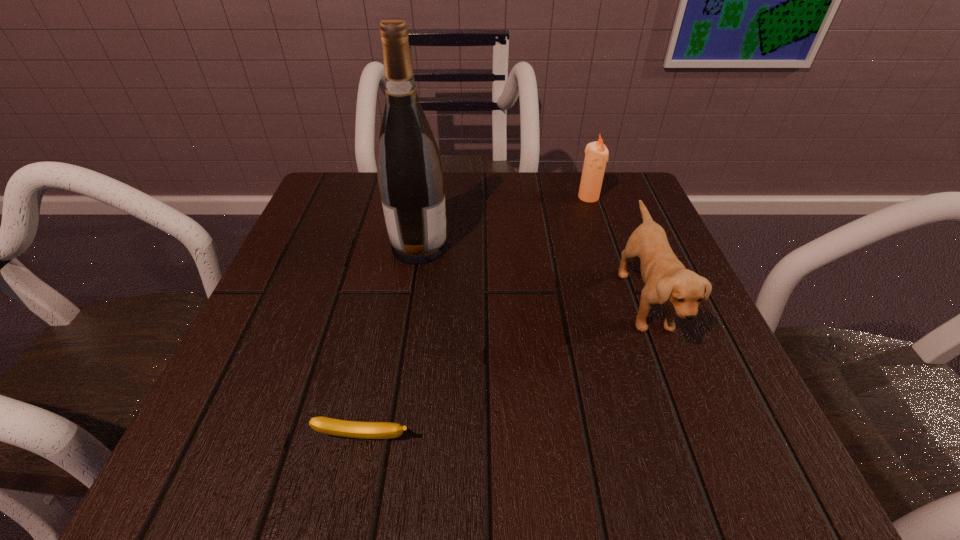
Image resolution: width=960 pixels, height=540 pixels. What are the coordinates of `wine bottle` in the screenshot? It's located at (410, 174).

I want to click on candle, so click(x=596, y=153).

Locate an element on the screen. puppy is located at coordinates (667, 282).

The image size is (960, 540). I want to click on the shortest object, so click(x=353, y=429).

At what (x,y) coordinates should I click in order to perform the action: click on the nearest object. Please return your answer as a coordinate pair (x, y). Image resolution: width=960 pixels, height=540 pixels. Looking at the image, I should click on (353, 429).

You are a GUI agent. You are given a task and a screenshot of the screen. Output one action in this format:
    pyautogui.click(x=<x>, y=<y>)
    Task: Click on the vacant space located on the label of the tallest object
    The height and width of the screenshot is (540, 960).
    Given the screenshot: What is the action you would take?
    [x=637, y=247]

Identify the location of free space located on the left of the farthest object. Image resolution: width=960 pixels, height=540 pixels. (430, 197).

Find the location of a particular element. The height and width of the screenshot is (540, 960). vacant area situated 0.360m on the left side of the puppy is located at coordinates (413, 301).

In order to click on free space located 0.110m on the left side of the puppy in this screenshot , I will do `click(559, 301)`.

This screenshot has width=960, height=540. In order to click on vacant space located on the left side of the puppy in this screenshot , I will do `click(582, 301)`.